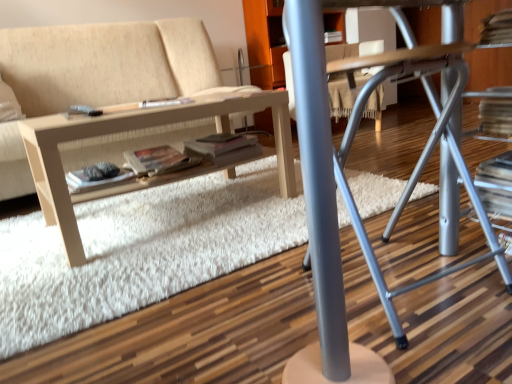
Where is `empty space that is ontop of white matte paperback book at center, which is counted as the 2th paperback book, starting from the right (from a real-world perspective)`? The width and height of the screenshot is (512, 384). empty space that is ontop of white matte paperback book at center, which is counted as the 2th paperback book, starting from the right (from a real-world perspective) is located at coordinates (94, 174).